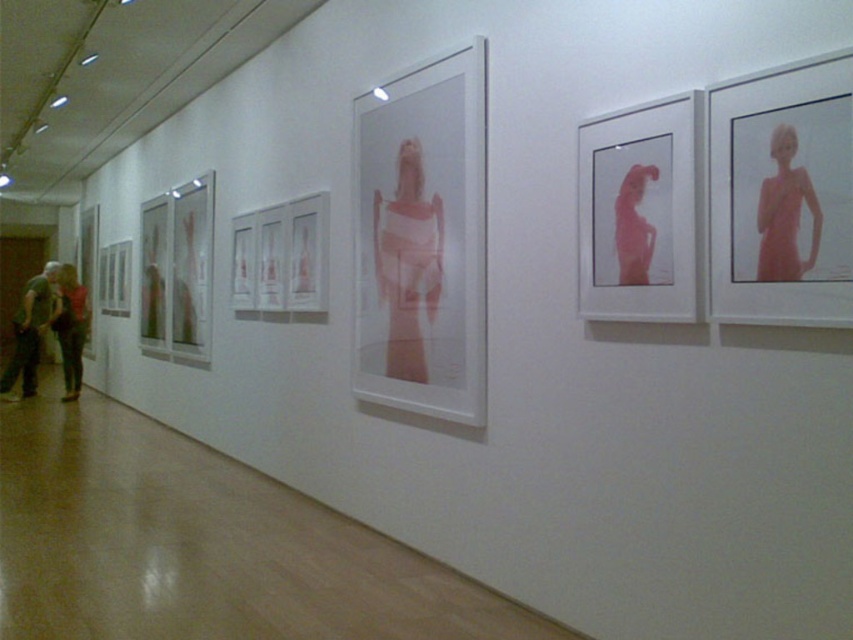
You are an art curator planning to rearrange the art gallery layout. You need to move the green cotton shirt at left closer to the pink matte dress at center. Currently, how far apart are they?

The distance between the green cotton shirt at left and the pink matte dress at center is 31.86 feet.

You are an art curator planning to hang a new painting in the gallery. The existing photograph with the translucent white dress at center is positioned at coordinates 0.411, 0.478. If your new painting is 1.2 meters wide, will it fit without overlapping this photograph?

The translucent white dress at center is located at point (407, 262). Since the new painting is 1.2 meters wide, you need to ensure there is sufficient space around the existing photograph. However, without knowing the exact dimensions of the photograph or the available wall space, it is impossible to determine if the painting will fit without overlapping. Please consult the gallery layout for precise measurements.